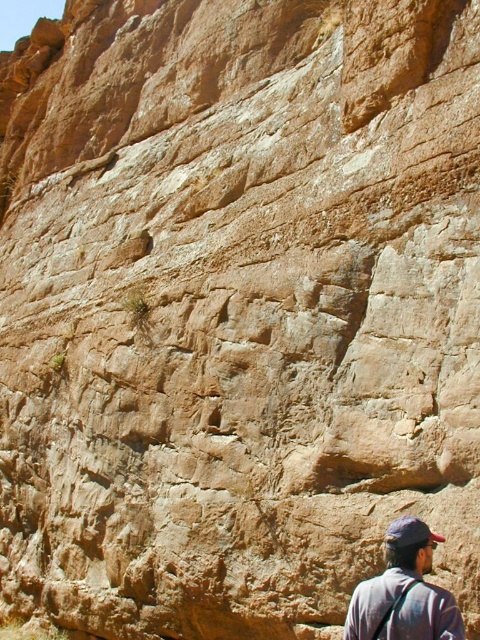
Question: Which point appears farthest from the camera in this image?

Choices:
 (A) pos(408,545)
 (B) pos(388,547)

Answer: (B)

Question: Can you confirm if dark gray fabric cap at upper right is bigger than dark blue fabric baseball cap at lower right?

Choices:
 (A) no
 (B) yes

Answer: (A)

Question: Can you confirm if dark gray fabric cap at upper right is thinner than dark blue fabric baseball cap at lower right?

Choices:
 (A) no
 (B) yes

Answer: (B)

Question: Considering the relative positions of dark gray fabric cap at upper right and dark blue fabric baseball cap at lower right in the image provided, where is dark gray fabric cap at upper right located with respect to dark blue fabric baseball cap at lower right?

Choices:
 (A) below
 (B) above

Answer: (A)

Question: Which point is farther to the camera?

Choices:
 (A) dark gray fabric cap at upper right
 (B) dark blue fabric baseball cap at lower right

Answer: (B)